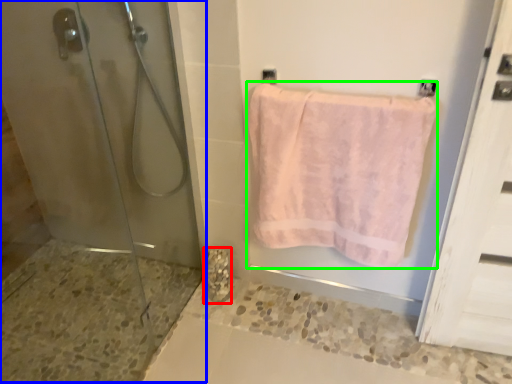
Question: Estimate the real-world distances between objects in this image. Which object is closer to marble (highlighted by a red box), shower door (highlighted by a blue box) or towel (highlighted by a green box)?

Choices:
 (A) shower door
 (B) towel

Answer: (A)